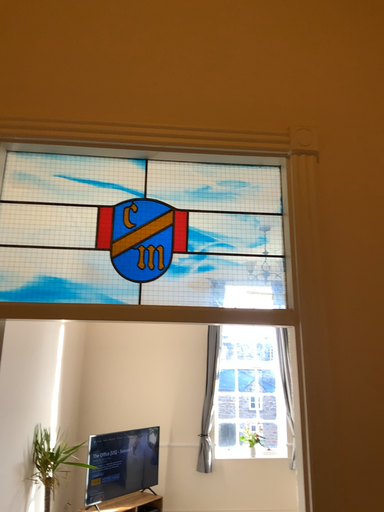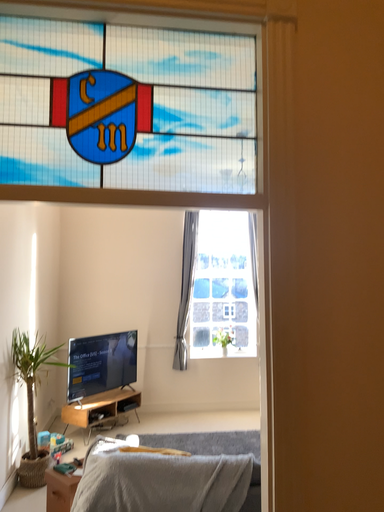
Question: Which way did the camera rotate in the video?

Choices:
 (A) rotated downward
 (B) rotated upward

Answer: (A)